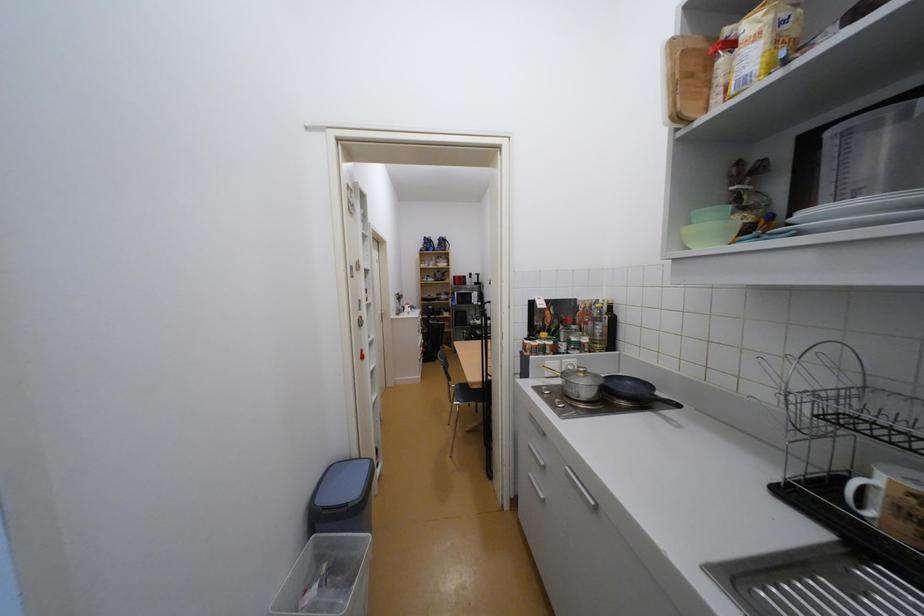
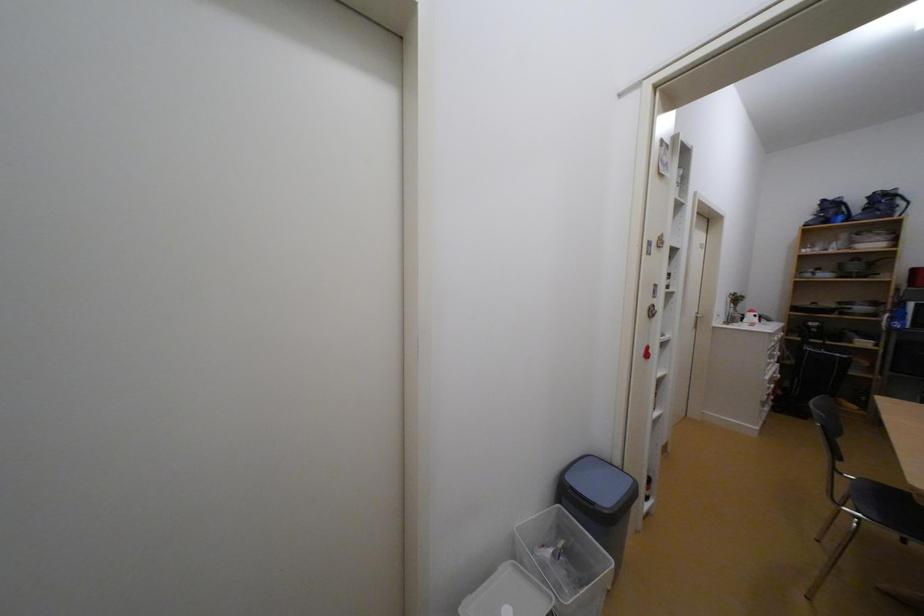
Question: The camera is either moving clockwise (left) or counter-clockwise (right) around the object. The first image is from the beginning of the video and the second image is from the end. Is the camera moving left or right when shooting the video?

Choices:
 (A) Left
 (B) Right

Answer: (B)